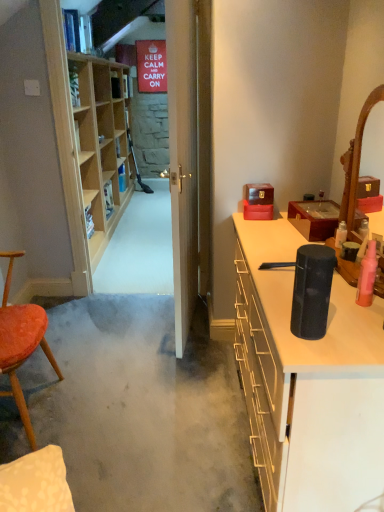
You are a GUI agent. You are given a task and a screenshot of the screen. Output one action in this format:
    pyautogui.click(x=<x>, y=<y>)
    Task: Click on the free space between pink matte bottle at right and black matte speaker at right
    
    Given the screenshot: What is the action you would take?
    pyautogui.click(x=342, y=315)